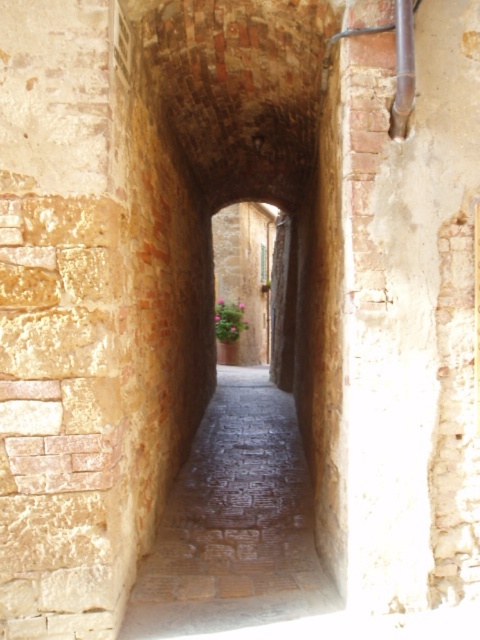
Can you confirm if brick tunnel at center is shorter than smooth stone path at center?

No, brick tunnel at center is not shorter than smooth stone path at center.

Does brick tunnel at center have a smaller size compared to smooth stone path at center?

No.

Describe the element at coordinates (219, 208) in the screenshot. I see `brick tunnel at center` at that location.

Find the location of a particular element. This screenshot has width=480, height=640. brick tunnel at center is located at coordinates (219, 208).